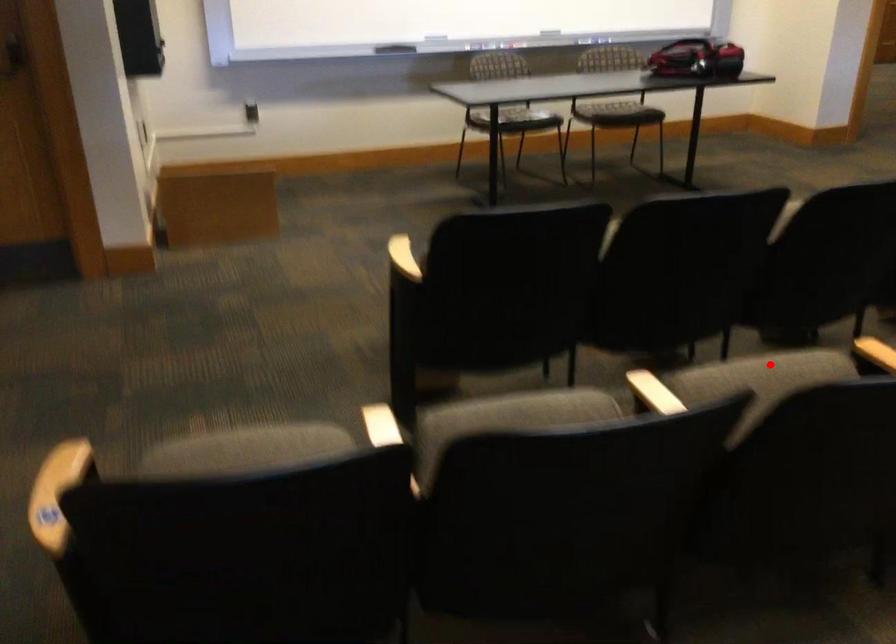
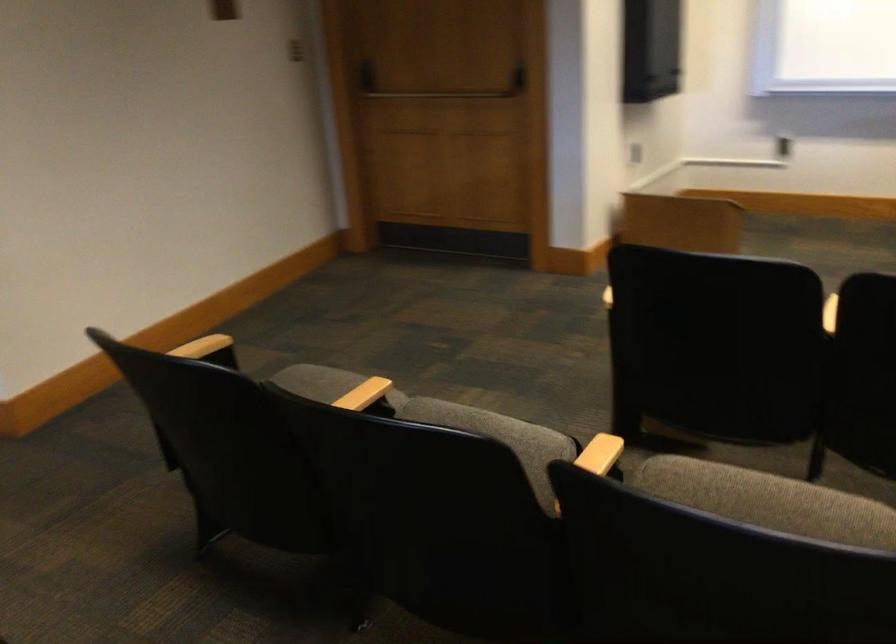
Question: I am providing you with two images of the same scene from different viewpoints. In image1, a red point is highlighted. Considering the same 3D point in image2, which of the following is correct?

Choices:
 (A) It is closer
 (B) It is farther

Answer: (A)